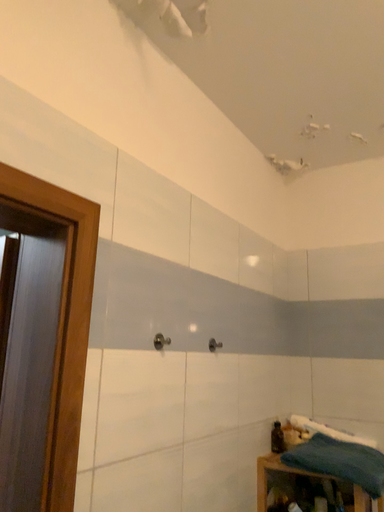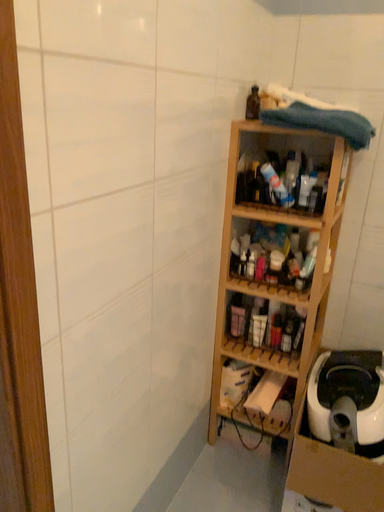
Question: Which way did the camera rotate in the video?

Choices:
 (A) rotated right
 (B) rotated left

Answer: (A)